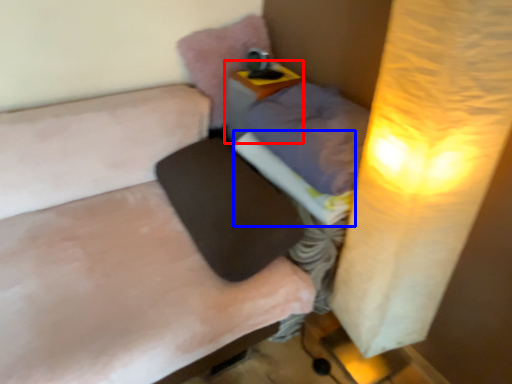
Question: Which object appears closest to the camera in this image, table (highlighted by a red box) or sheet (highlighted by a blue box)?

Choices:
 (A) table
 (B) sheet

Answer: (B)